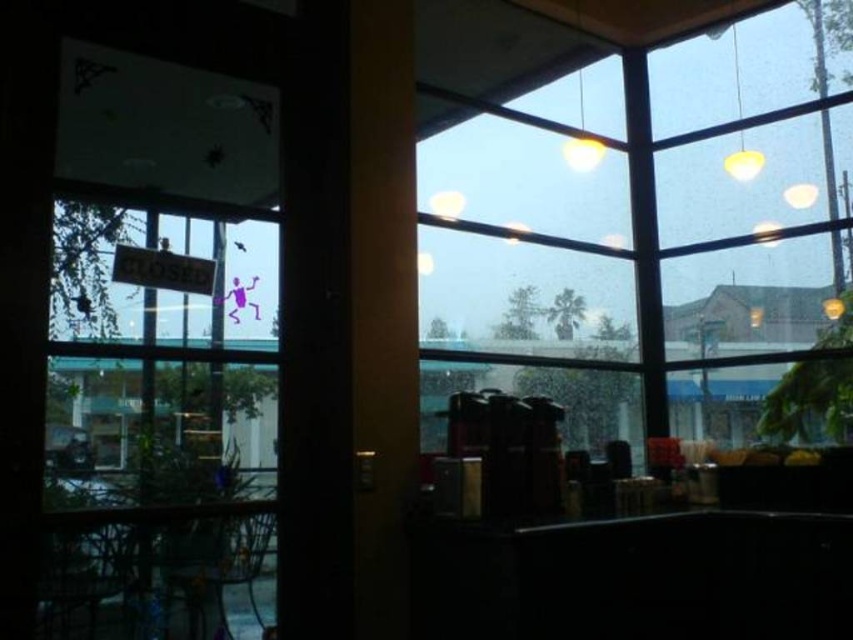
You are a customer trying to read the small red sign that says CLOSED on the transparent glass window at upper right. The yellow matte lamp at upper right is casting a shadow. Which object is taller so that its shadow might block the sign?

The transparent glass window at upper right is taller than the yellow matte lamp at upper right, so its shadow might block the sign.

You are a delivery person trying to see the menu displayed on the wall behind the counter. You notice both the transparent glass window at upper right and the transparent glass door at left. Which one allows you to see the menu more clearly due to its height?

The transparent glass window at upper right allows you to see the menu more clearly because it has a greater height compared to the transparent glass door at left, providing a better vantage point.